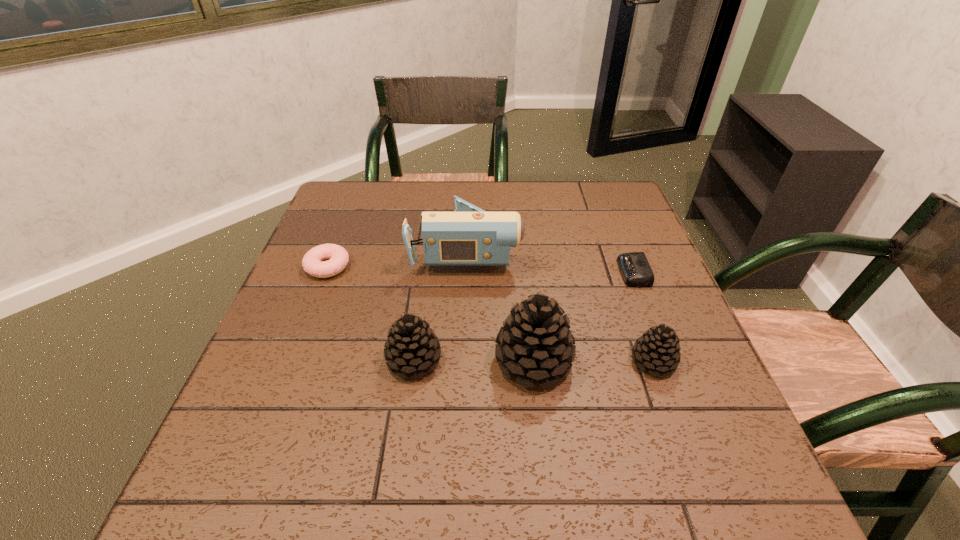
The width and height of the screenshot is (960, 540). I want to click on the second shortest pinecone, so click(x=411, y=347).

The height and width of the screenshot is (540, 960). What are the coordinates of `the third tallest object` in the screenshot? It's located at (411, 347).

Locate an element on the screen. The width and height of the screenshot is (960, 540). the second pinecone from left to right is located at coordinates (535, 341).

Where is `the rightmost pinecone`? This screenshot has width=960, height=540. the rightmost pinecone is located at coordinates (657, 349).

Find the location of a particular element. The image size is (960, 540). the third shortest object is located at coordinates (657, 349).

You are a GUI agent. You are given a task and a screenshot of the screen. Output one action in this format:
    pyautogui.click(x=<x>, y=<y>)
    Task: Click on the alarm clock
    This screenshot has width=960, height=540.
    Given the screenshot: What is the action you would take?
    pyautogui.click(x=635, y=269)

Locate an element on the screen. The height and width of the screenshot is (540, 960). camcorder is located at coordinates (469, 236).

Where is `doughnut`? The image size is (960, 540). doughnut is located at coordinates (337, 256).

The image size is (960, 540). I want to click on the second shortest object, so click(337, 256).

Where is `vacant point located at the narrow end of the second tallest pinecone`? The image size is (960, 540). vacant point located at the narrow end of the second tallest pinecone is located at coordinates (510, 360).